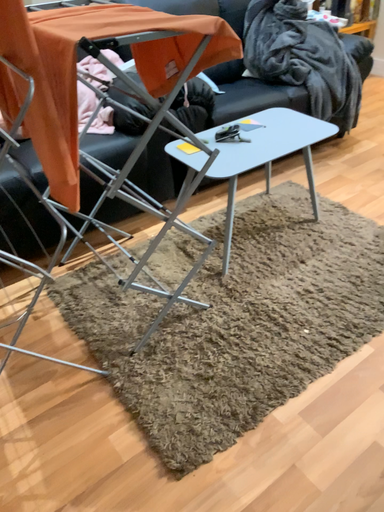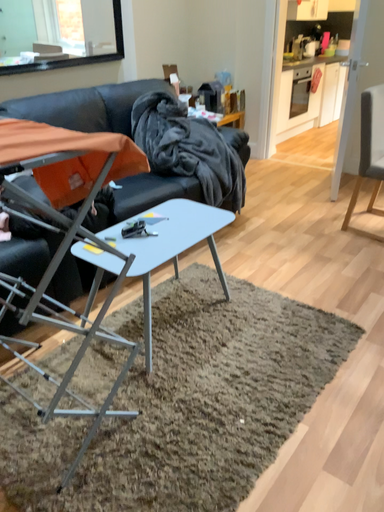
Question: How did the camera likely rotate when shooting the video?

Choices:
 (A) rotated downward
 (B) rotated upward

Answer: (B)